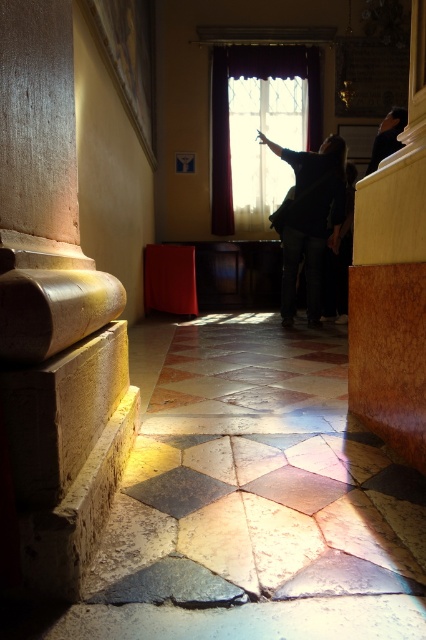
You are a maintenance worker needing to move a 4.5 meter long ladder from the polished stone column at left to the dark blue fabric at upper right. Can you move it horizontally without tilting or lifting it vertically? Please explain your reasoning.

The distance between the polished stone column at left and the dark blue fabric at upper right is 3.93 meters. Since the ladder is 4.5 meters long, which is longer than the available space, you cannot move it horizontally without tilting or lifting it vertically.

You are an interior designer working on a project in this space. You need to place a 30 inch wide decorative panel between the dark fabric at center and the dark blue fabric at upper right. Will there be enough space?

The dark fabric at center is 29.66 inches from the dark blue fabric at upper right. Since the panel is 30 inches wide, it will not fit between them as the available space is slightly smaller.